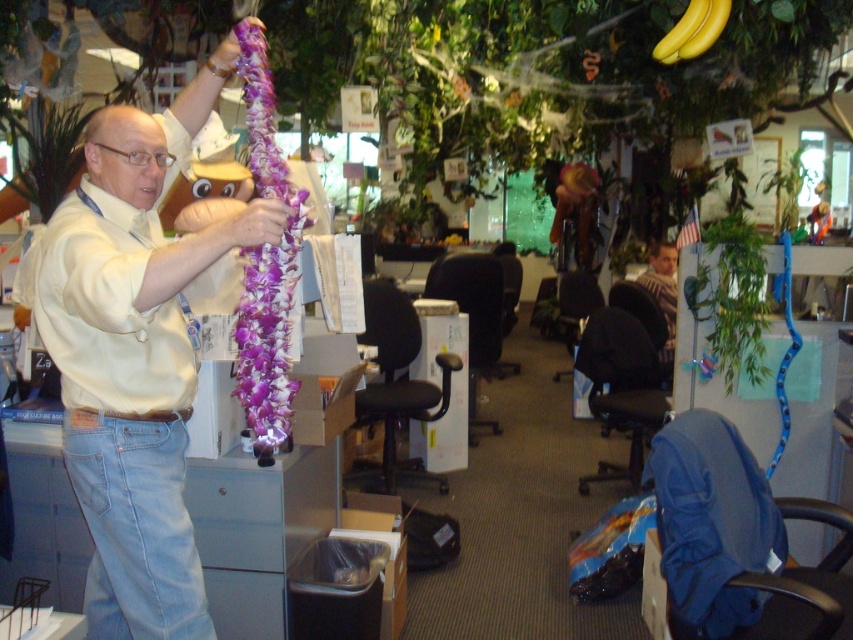
You are standing in the office and need to place a new potted plant. The plant should be positioned to the right of the light blue denim jeans at lower left. Where should you place the plant?

The light blue denim jeans at lower left is located at point (136, 525). To place the plant to the right of it, position it at coordinates higher than 0.822 on the x axis while maintaining the same y coordinate of 0.161.

You are an office worker who needs to place a new poster on the wall. The poster is 10 cm wide. The yellow smooth bananas at upper center are located at coordinates 0.048, 0.814. Can you hang the poster without overlapping the bananas?

The yellow smooth bananas at upper center are located at coordinates (693,29). Since the poster is 10 cm wide, you can hang it in a different location on the wall to avoid overlapping the bananas.